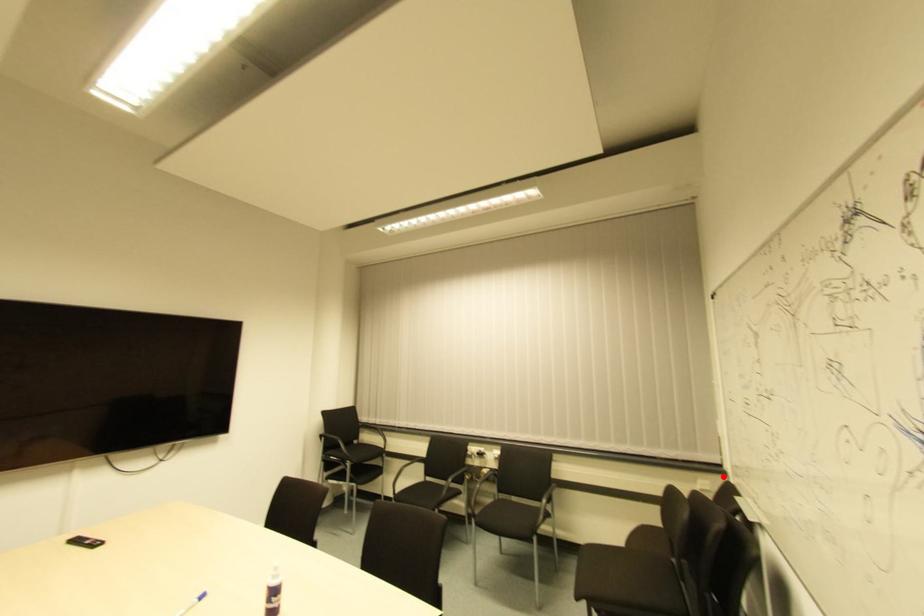
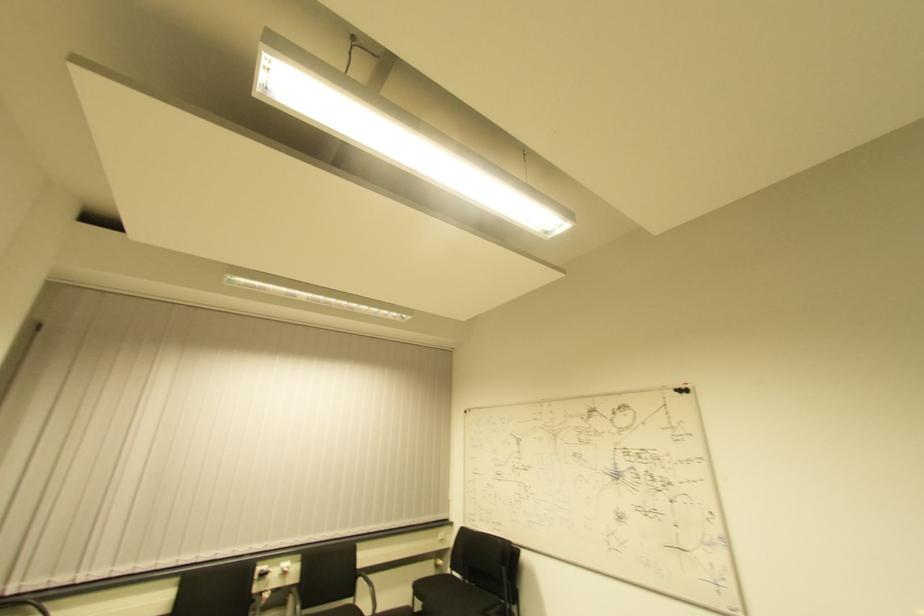
Question: A red point is marked in image1. In image2, is the corresponding 3D point closer to the camera or farther? Reply with the corresponding letter.

Choices:
 (A) The corresponding 3D point is closer.
 (B) The corresponding 3D point is farther.

Answer: (B)